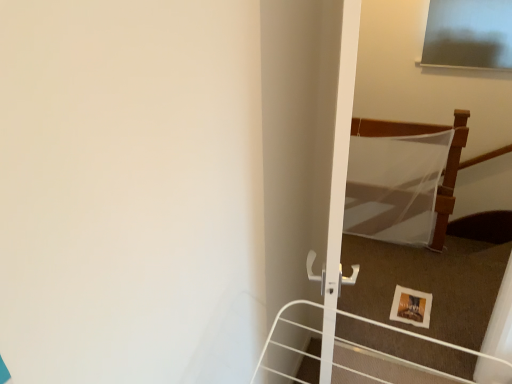
Question: From the image's perspective, is wooden picture frame at lower right over white sheer fabric at upper right?

Choices:
 (A) no
 (B) yes

Answer: (A)

Question: Can we say wooden picture frame at lower right lies outside white sheer fabric at upper right?

Choices:
 (A) yes
 (B) no

Answer: (A)

Question: Is wooden picture frame at lower right next to white sheer fabric at upper right and touching it?

Choices:
 (A) no
 (B) yes

Answer: (A)

Question: Considering the relative sizes of wooden picture frame at lower right and white sheer fabric at upper right in the image provided, is wooden picture frame at lower right wider than white sheer fabric at upper right?

Choices:
 (A) no
 (B) yes

Answer: (B)

Question: Is wooden picture frame at lower right shorter than white sheer fabric at upper right?

Choices:
 (A) no
 (B) yes

Answer: (B)

Question: From a real-world perspective, is wooden picture frame at lower right over white sheer fabric at upper right?

Choices:
 (A) no
 (B) yes

Answer: (A)

Question: From a real-world perspective, is white sheer fabric at upper right on wooden picture frame at lower right?

Choices:
 (A) no
 (B) yes

Answer: (B)

Question: Can we say white sheer fabric at upper right lies outside wooden picture frame at lower right?

Choices:
 (A) no
 (B) yes

Answer: (B)

Question: Is white sheer fabric at upper right at the right side of wooden picture frame at lower right?

Choices:
 (A) yes
 (B) no

Answer: (A)

Question: Is white sheer fabric at upper right beside wooden picture frame at lower right?

Choices:
 (A) yes
 (B) no

Answer: (B)

Question: Is white sheer fabric at upper right bigger than wooden picture frame at lower right?

Choices:
 (A) yes
 (B) no

Answer: (A)

Question: Is white sheer fabric at upper right taller than wooden picture frame at lower right?

Choices:
 (A) no
 (B) yes

Answer: (B)

Question: From a real-world perspective, is white sheer fabric at upper right physically located above or below wooden picture frame at lower right?

Choices:
 (A) above
 (B) below

Answer: (A)